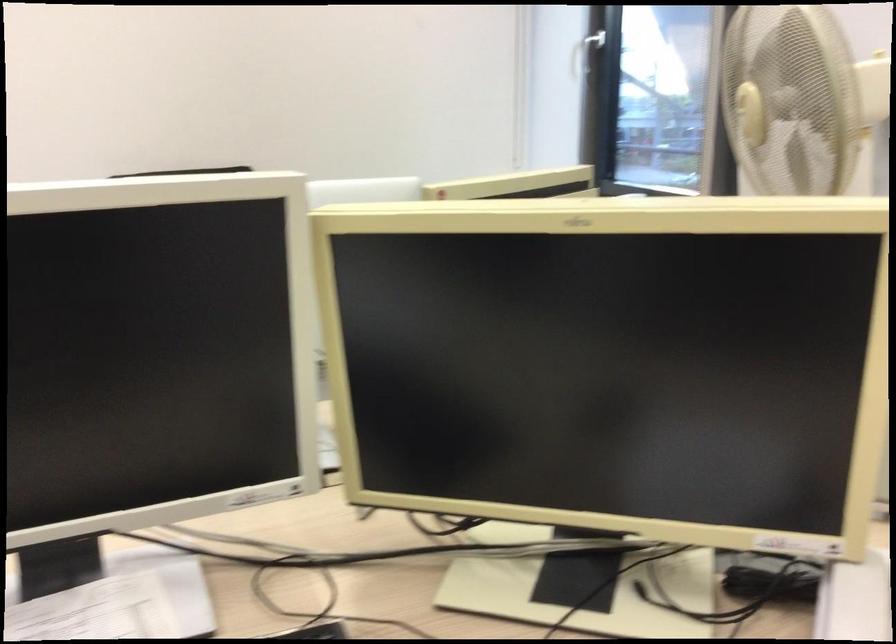
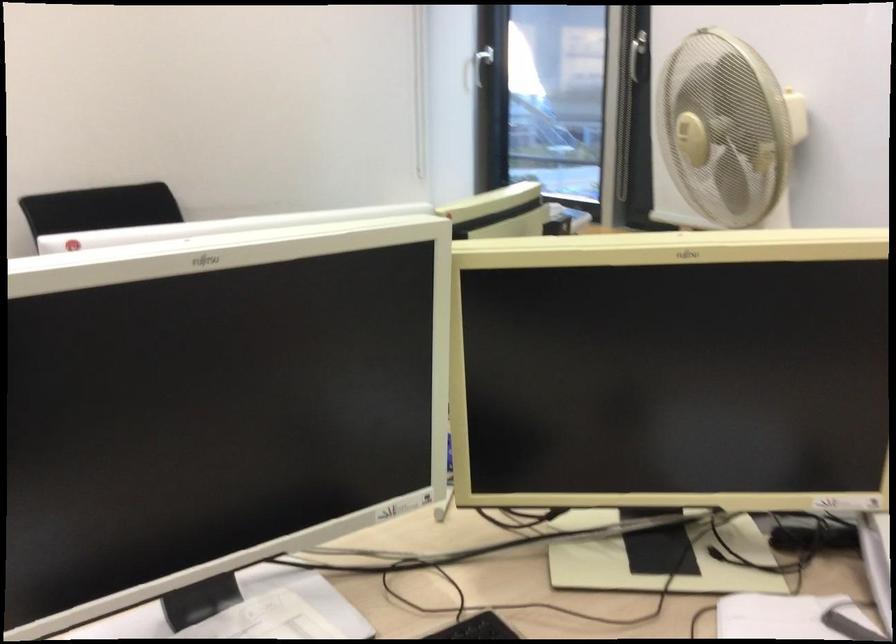
The point at (579, 368) is marked in the first image. Where is the corresponding point in the second image?

(673, 371)